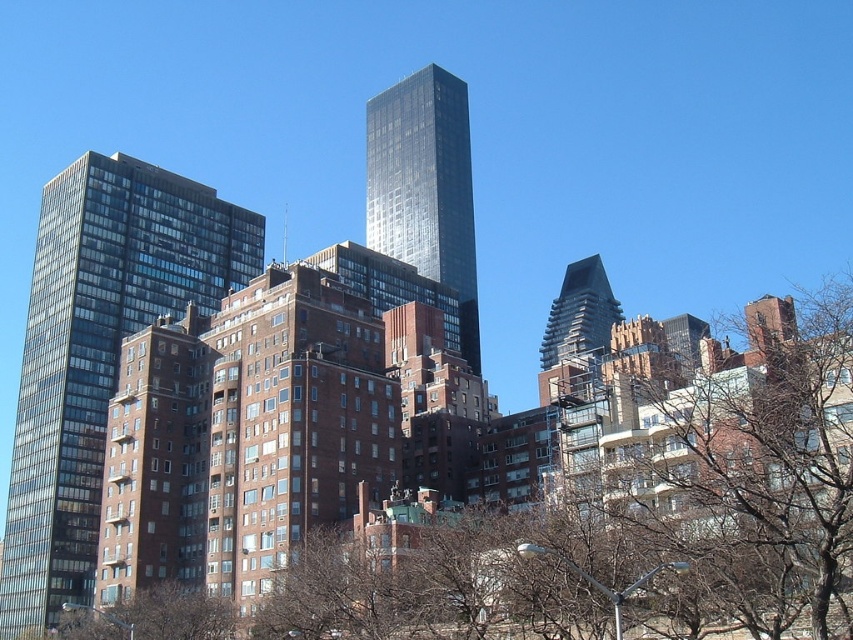
You are a drone operator who needs to fly a drone between the brown leafless tree at center and the glassy reflective building at left. The drone has a maximum flight distance of 30 meters. Can the drone complete this task without exceeding its range?

The brown leafless tree at center is 31.63 meters away from the glassy reflective building at left. Since the drone has a maximum flight distance of 30 meters, it cannot complete the task without exceeding its range.

In the urban skyline scene, there is a brown leafless tree at center and a glassy reflective building at left. Which object occupies a larger area in the image?

The brown leafless tree at center is bigger than the glassy reflective building at left, so it occupies a larger area in the image.